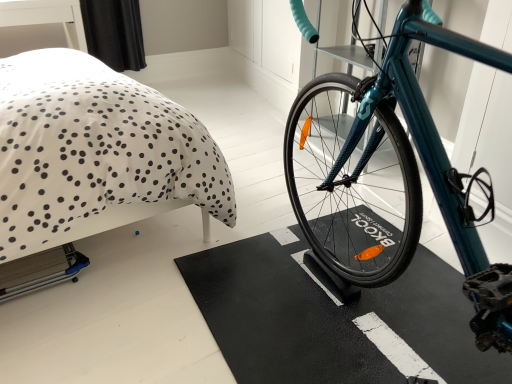
Question: Considering the relative sizes of white dotted fabric at upper left and black rubber bath mat at center in the image provided, is white dotted fabric at upper left smaller than black rubber bath mat at center?

Choices:
 (A) yes
 (B) no

Answer: (B)

Question: Does white dotted fabric at upper left have a lesser height compared to black rubber bath mat at center?

Choices:
 (A) yes
 (B) no

Answer: (B)

Question: Are white dotted fabric at upper left and black rubber bath mat at center far apart?

Choices:
 (A) yes
 (B) no

Answer: (B)

Question: Does white dotted fabric at upper left appear on the left side of black rubber bath mat at center?

Choices:
 (A) no
 (B) yes

Answer: (B)

Question: Considering the relative sizes of white dotted fabric at upper left and black rubber bath mat at center in the image provided, is white dotted fabric at upper left thinner than black rubber bath mat at center?

Choices:
 (A) yes
 (B) no

Answer: (A)

Question: In terms of size, does black rubber bath mat at center appear bigger or smaller than teal glossy bicycle at center?

Choices:
 (A) big
 (B) small

Answer: (B)

Question: From their relative heights in the image, would you say black rubber bath mat at center is taller or shorter than teal glossy bicycle at center?

Choices:
 (A) tall
 (B) short

Answer: (B)

Question: From the image's perspective, is black rubber bath mat at center above or below teal glossy bicycle at center?

Choices:
 (A) above
 (B) below

Answer: (B)

Question: Looking at their shapes, would you say black rubber bath mat at center is wider or thinner than teal glossy bicycle at center?

Choices:
 (A) wide
 (B) thin

Answer: (B)

Question: From a real-world perspective, is white dotted fabric at upper left positioned above or below black rubber bath mat at center?

Choices:
 (A) below
 (B) above

Answer: (B)

Question: Is white dotted fabric at upper left spatially inside black rubber bath mat at center, or outside of it?

Choices:
 (A) outside
 (B) inside

Answer: (A)

Question: Is white dotted fabric at upper left in front of or behind black rubber bath mat at center in the image?

Choices:
 (A) behind
 (B) front

Answer: (B)

Question: Is point (45, 115) positioned closer to the camera than point (422, 312)?

Choices:
 (A) farther
 (B) closer

Answer: (B)

Question: From a real-world perspective, is white dotted fabric at upper left positioned above or below teal glossy bicycle at center?

Choices:
 (A) above
 (B) below

Answer: (B)

Question: Which is correct: white dotted fabric at upper left is inside teal glossy bicycle at center, or outside of it?

Choices:
 (A) inside
 (B) outside

Answer: (B)